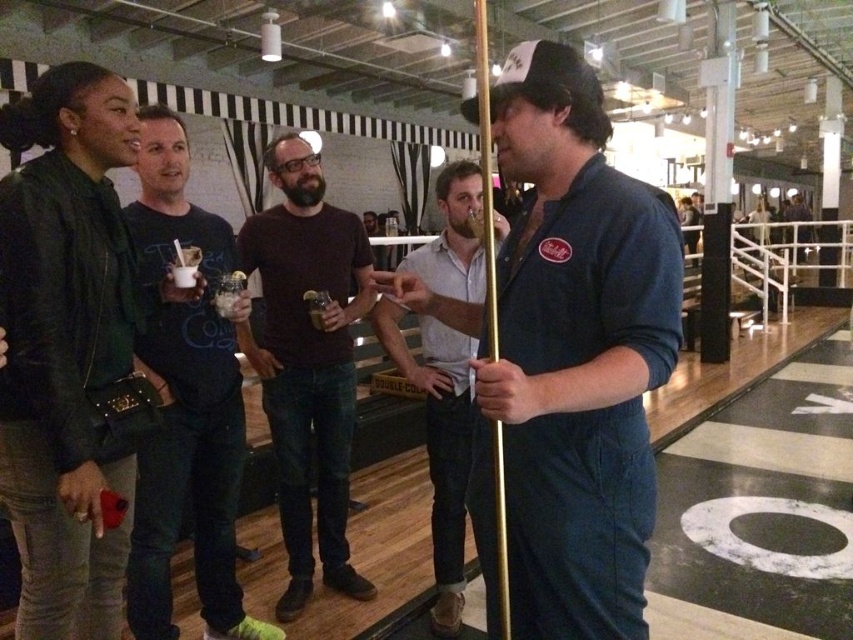
You are standing at the entrance of the venue and see the point marked at coordinates (576, 353). What object is located at that point?

The point at coordinates (576, 353) marks the denim jumpsuit at center.